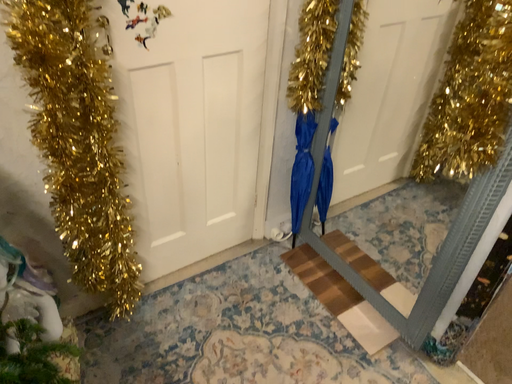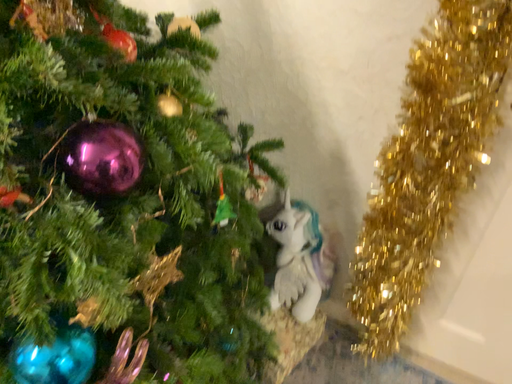
Question: How did the camera likely rotate when shooting the video?

Choices:
 (A) rotated downward
 (B) rotated upward

Answer: (B)